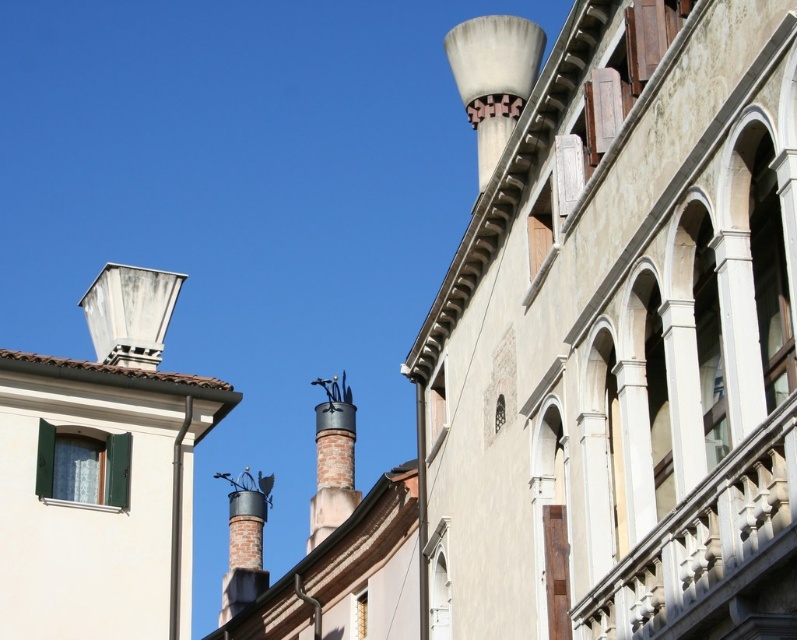
Between point (457, 84) and point (163, 298), which one is positioned in front?

Positioned in front is point (163, 298).

Is white matte chimney at upper right further to the viewer compared to white concrete chimney at upper left?

No, it is in front of white concrete chimney at upper left.

Is point (521, 61) closer to camera compared to point (120, 333)?

That is True.

Find the location of `white matte chimney at upper right`. white matte chimney at upper right is located at coordinates (493, 77).

Does white matte chimney at upper right have a greater width compared to polished metal chimney at center?

Indeed, white matte chimney at upper right has a greater width compared to polished metal chimney at center.

Is white matte chimney at upper right closer to the viewer compared to polished metal chimney at center?

Yes, it is in front of polished metal chimney at center.

At what (x,y) coordinates should I click in order to perform the action: click on white matte chimney at upper right. Please return your answer as a coordinate pair (x, y). Looking at the image, I should click on (493, 77).

You are a GUI agent. You are given a task and a screenshot of the screen. Output one action in this format:
    pyautogui.click(x=<x>, y=<y>)
    Task: Click on the white matte chimney at upper right
    
    Given the screenshot: What is the action you would take?
    pyautogui.click(x=493, y=77)

Between white concrete chimney at upper left and polished metal chimney at center, which one has more height?

With more height is polished metal chimney at center.

Between point (159, 304) and point (336, 470), which one is positioned in front?

Positioned in front is point (159, 304).

In the scene shown: Who is more forward, (97, 332) or (320, 493)?

Point (97, 332)

Identify the location of white concrete chimney at upper left. This screenshot has height=640, width=797. (128, 314).